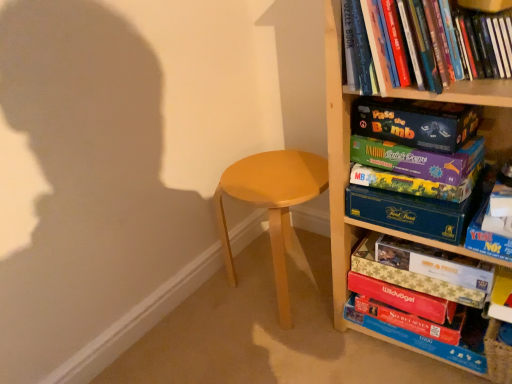
Identify the location of free location above blue cardboard game box at center-right, placed as the 4th paperback book when sorted from top to bottom (from a real-world perspective). Image resolution: width=512 pixels, height=384 pixels. (409, 183).